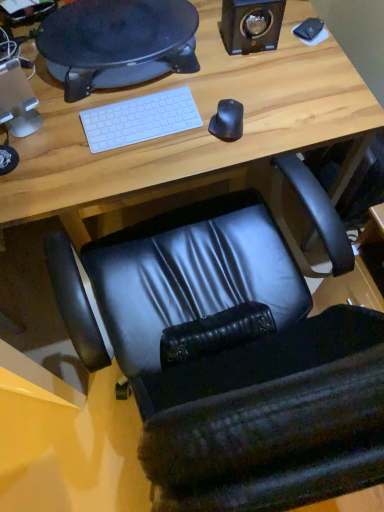
This screenshot has height=512, width=384. Identify the location of vacant area that lies between white matte keyboard at center and matte black desk at upper center. (132, 96).